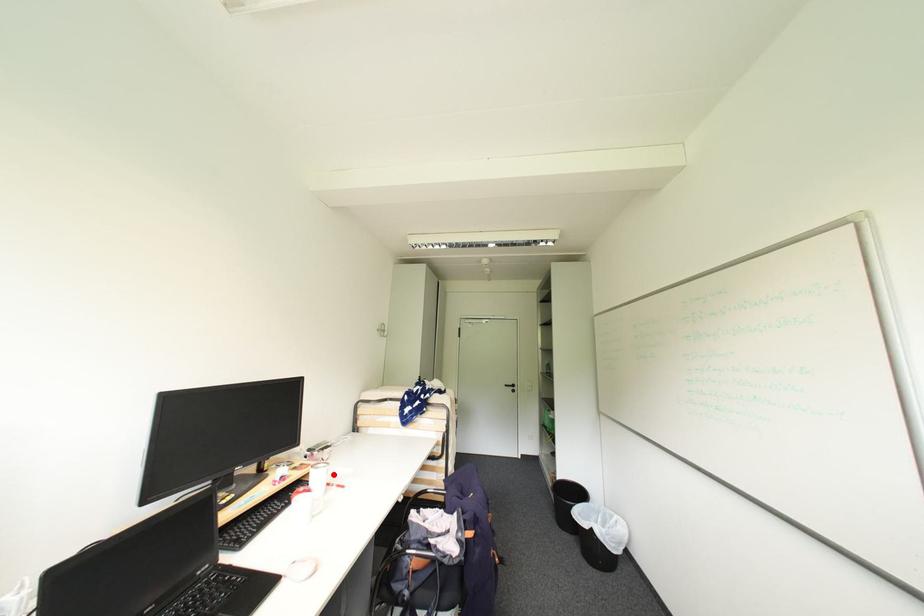
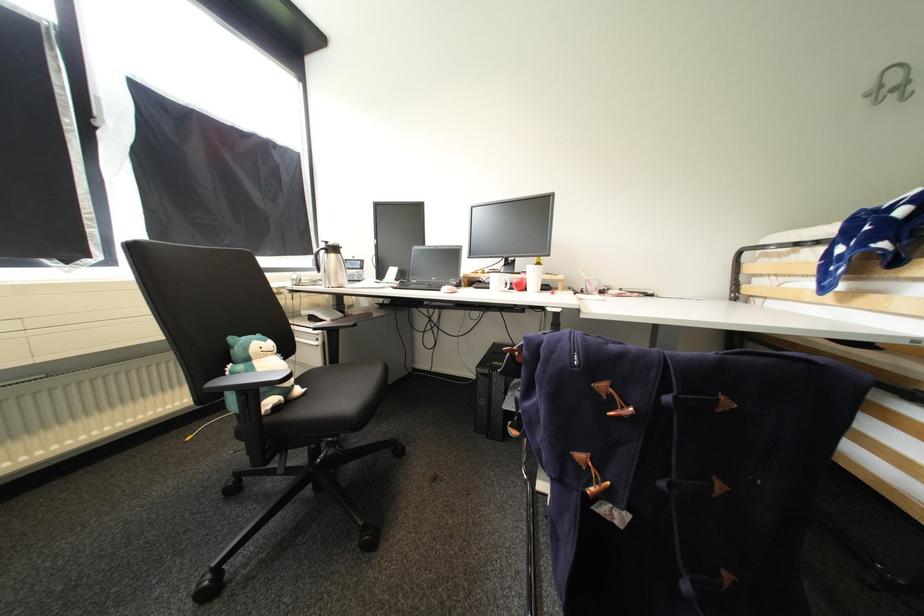
In the second image, find the point that corresponds to the highlighted location in the first image.

(541, 273)